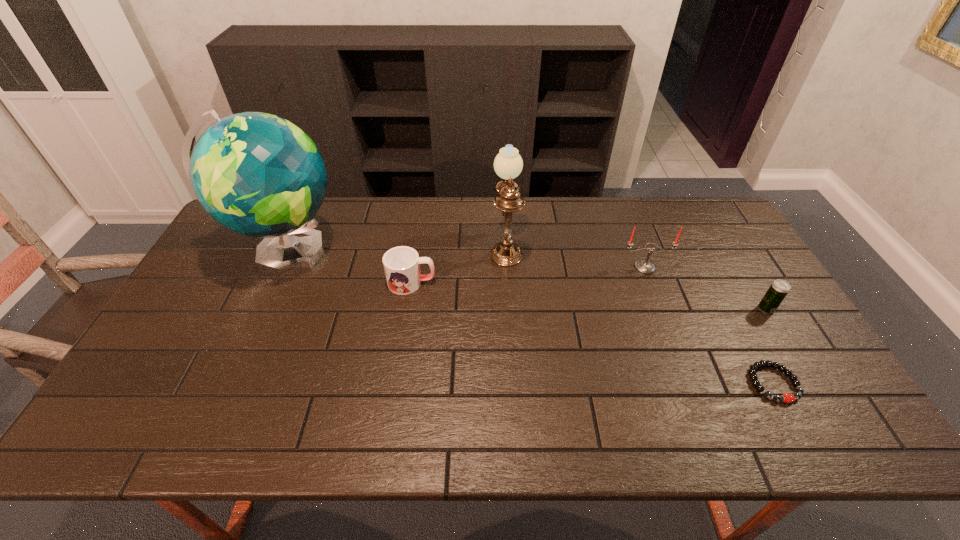
Where is `beer can present at the right edge`? The height and width of the screenshot is (540, 960). beer can present at the right edge is located at coordinates (778, 290).

Locate an element on the screen. The image size is (960, 540). bracelet at the right edge is located at coordinates (787, 398).

Locate an element on the screen. Image resolution: width=960 pixels, height=540 pixels. object that is at the far left corner is located at coordinates point(257,174).

The width and height of the screenshot is (960, 540). I want to click on vacant region at the far edge of the desktop, so click(x=369, y=203).

In the image, there is a desktop. Where is `vacant area at the near edge`? The width and height of the screenshot is (960, 540). vacant area at the near edge is located at coordinates (252, 444).

This screenshot has width=960, height=540. I want to click on free location at the left edge, so click(174, 318).

At what (x,y) coordinates should I click in order to perform the action: click on blank area at the right edge. Please return your answer as a coordinate pair (x, y). Looking at the image, I should click on (725, 248).

This screenshot has width=960, height=540. I want to click on free space at the near left corner, so click(127, 435).

Where is `vacant space in between the fourth shortest object and the beer can`? Image resolution: width=960 pixels, height=540 pixels. vacant space in between the fourth shortest object and the beer can is located at coordinates (706, 288).

The height and width of the screenshot is (540, 960). In order to click on vacant point located between the fifth shortest object and the second object from left to right in this screenshot , I will do `click(459, 264)`.